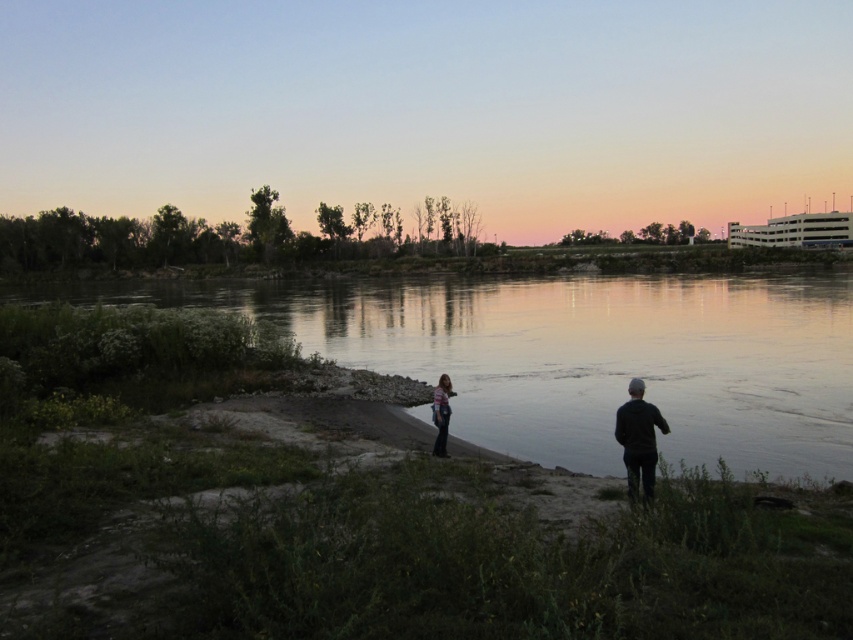
You are standing at point (x=451, y=394) and want to walk to the riverbank. Is point (x=347, y=324) behind you or in front of you?

Point (x=347, y=324) is behind point (x=451, y=394), so it is behind you.

Looking at this image, you are a photographer trying to capture the two people in the scene. The dark green jacket at lower right and the striped fabric person at center are both in your viewfinder. Which person is positioned higher in the frame?

The dark green jacket at lower right is above the striped fabric person at center, so the person wearing the dark green jacket at lower right is positioned higher in the frame.

You are a photographer trying to capture the reflection of the sunset in the smooth water at center. However, the striped fabric person at center is blocking your view. Can you estimate whether the person is shorter than the water surface to potentially crouch and still see the reflection?

The smooth water at center has a greater height compared to striped fabric person at center, so the person is shorter than the water surface. You can crouch to see the reflection.